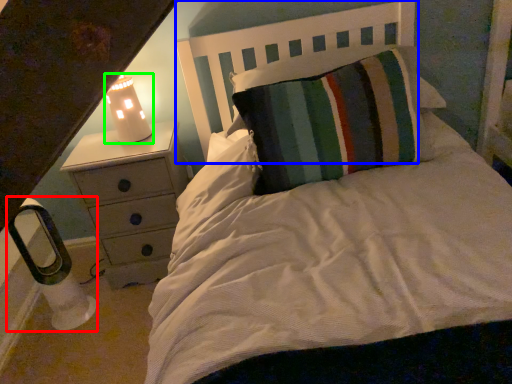
Question: Estimate the real-world distances between objects in this image. Which object is farther from lamp (highlighted by a red box), headboard (highlighted by a blue box) or lamp (highlighted by a green box)?

Choices:
 (A) headboard
 (B) lamp

Answer: (A)